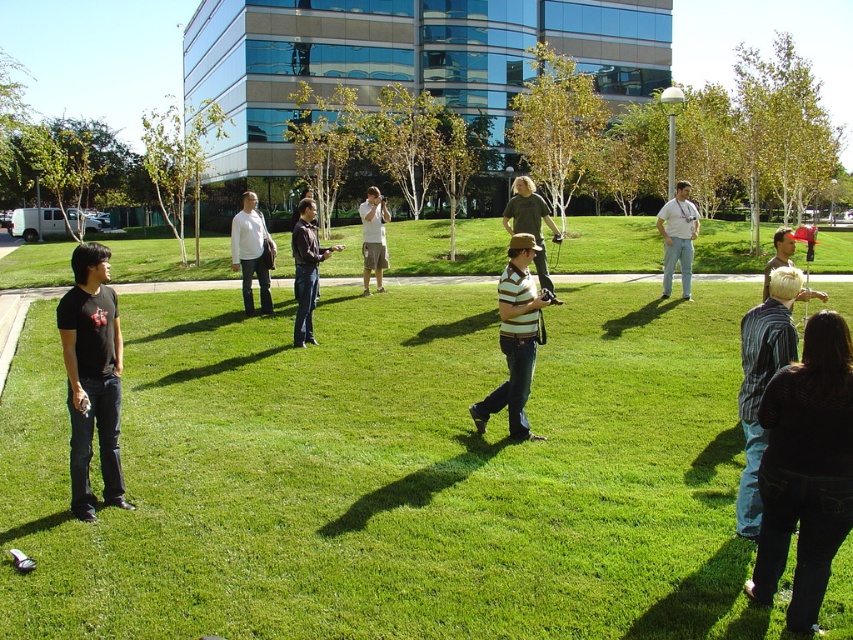
Question: Is light blue shirt at center thinner than light brown hair at lower right?

Choices:
 (A) yes
 (B) no

Answer: (A)

Question: Which object appears farthest from the camera in this image?

Choices:
 (A) white shirt at center
 (B) black matte t-shirt at left
 (C) light brown hair at lower right
 (D) dark blue jeans at lower right

Answer: (A)

Question: Which of these objects is positioned closest to the dark brown shirt at center?

Choices:
 (A) light brown cotton shirt at center
 (B) striped cotton shirt at center
 (C) light brown hair at lower right

Answer: (A)

Question: Does blue striped shirt at center appear on the right side of light brown cotton shirt at center?

Choices:
 (A) no
 (B) yes

Answer: (B)

Question: Which point appears closest to the camera in this image?

Choices:
 (A) (759, 317)
 (B) (251, 198)
 (C) (84, 513)
 (D) (834, 396)

Answer: (D)

Question: Is light blue shirt at center smaller than light brown hair at lower right?

Choices:
 (A) no
 (B) yes

Answer: (B)